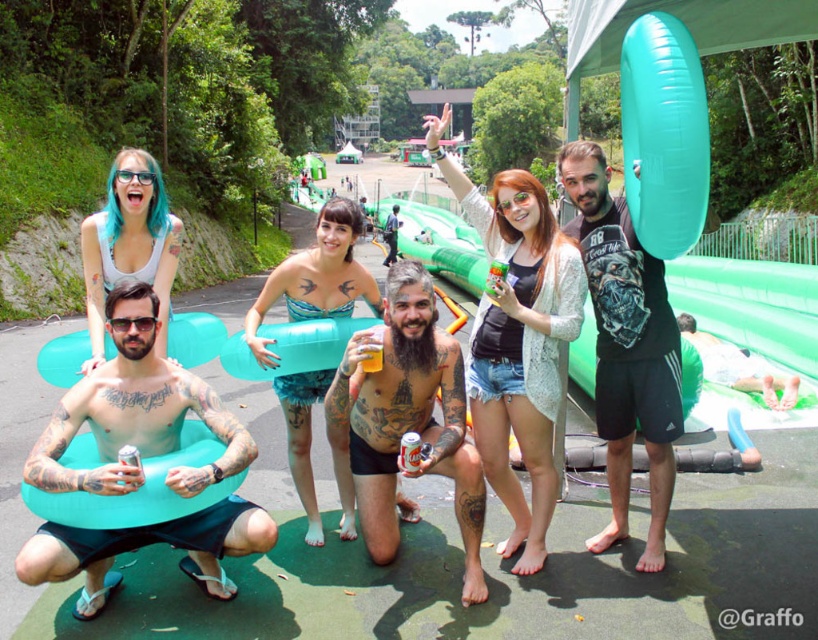
Question: Which object appears farthest from the camera in this image?

Choices:
 (A) matte black tank top at center
 (B) tattooed skin at center
 (C) blue rubber ring at center

Answer: (C)

Question: Is black matte t-shirt at center thinner than tattooed skin at center?

Choices:
 (A) yes
 (B) no

Answer: (A)

Question: Is matte black tank top at center positioned at the back of blue rubber ring at center?

Choices:
 (A) yes
 (B) no

Answer: (B)

Question: Which point is closer to the camera?

Choices:
 (A) black matte t-shirt at center
 (B) matte black tank top at center

Answer: (B)

Question: Can you confirm if matte black tank top at center is positioned to the left of blue rubber ring at center?

Choices:
 (A) yes
 (B) no

Answer: (B)

Question: Which of the following is the farthest from the observer?

Choices:
 (A) (502, 328)
 (B) (380, 330)
 (C) (601, 336)
 (D) (344, 353)

Answer: (C)